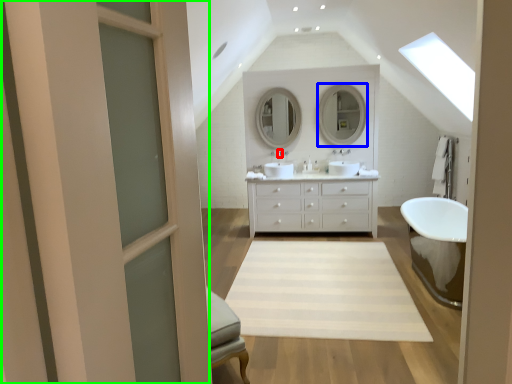
Question: Considering the real-world distances, which object is closest to faucet (highlighted by a red box)? mirror (highlighted by a blue box) or screen door (highlighted by a green box).

Choices:
 (A) mirror
 (B) screen door

Answer: (A)